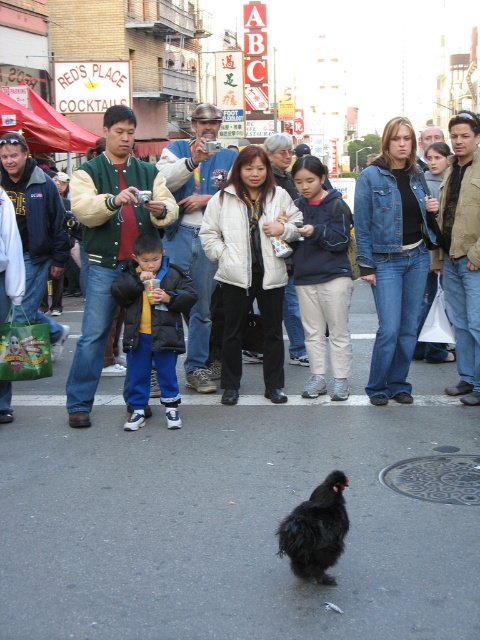
You are a photographer trying to capture the perfect shot of the matte black chicken at center. Based on its position in the image, what are the coordinates where you should aim your camera?

The coordinates for the matte black chicken at center are at point (264, 333), so aim your camera there.

You are a photographer trying to capture a clear photo of the black fluffy chicken at center without the matte black chicken at center blocking it. How should you adjust your position?

Move forward to get closer to the black fluffy chicken at center so it moves in front of the matte black chicken at center, or move to the side to find an angle where the black fluffy chicken at center is no longer obscured by the matte black chicken at center.